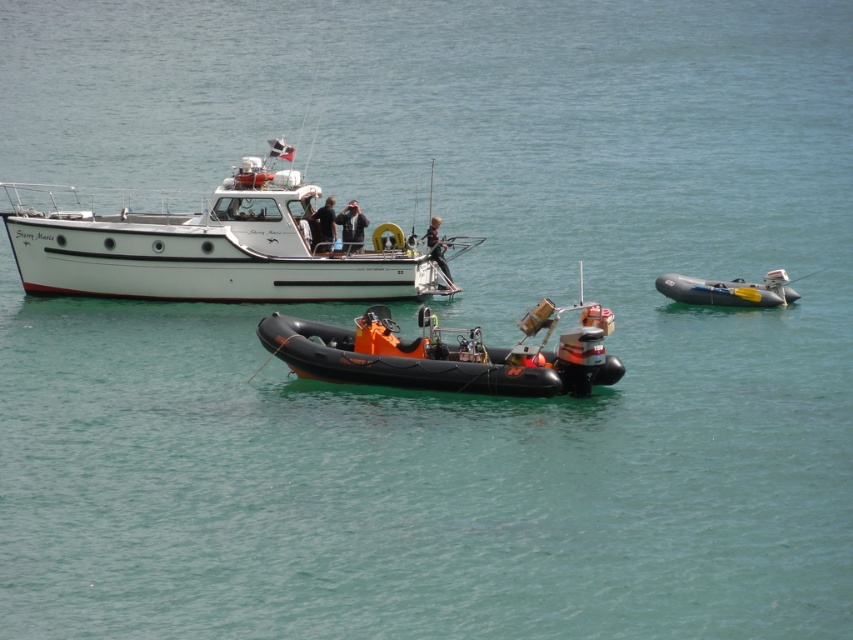
Question: Which object is positioned farthest from the dark gray jacket at center?

Choices:
 (A) black rubber wetsuit at center
 (B) black fabric jacket at upper center
 (C) rubber inflatable boat at right

Answer: (C)

Question: Is dark gray jacket at center wider than black rubber wetsuit at center?

Choices:
 (A) no
 (B) yes

Answer: (A)

Question: Estimate the real-world distances between objects in this image. Which object is closer to the rubber inflatable boat at right?

Choices:
 (A) white matte boat at upper center
 (B) dark gray jacket at center
 (C) black fabric jacket at upper center

Answer: (B)

Question: In this image, where is white matte boat at upper center located relative to black rubber wetsuit at center?

Choices:
 (A) left
 (B) right

Answer: (A)

Question: Is rubber inflatable boat at right further to the viewer compared to black fabric jacket at upper center?

Choices:
 (A) yes
 (B) no

Answer: (B)

Question: Considering the real-world distances, which object is farthest from the white matte boat at upper center?

Choices:
 (A) black rubber dinghy at center
 (B) rubber inflatable boat at right
 (C) black fabric jacket at upper center

Answer: (B)